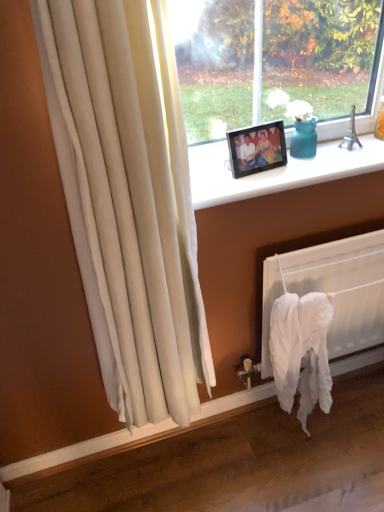
Where is `free space in front of black plastic picture frame at upper center`? The height and width of the screenshot is (512, 384). free space in front of black plastic picture frame at upper center is located at coordinates point(258,182).